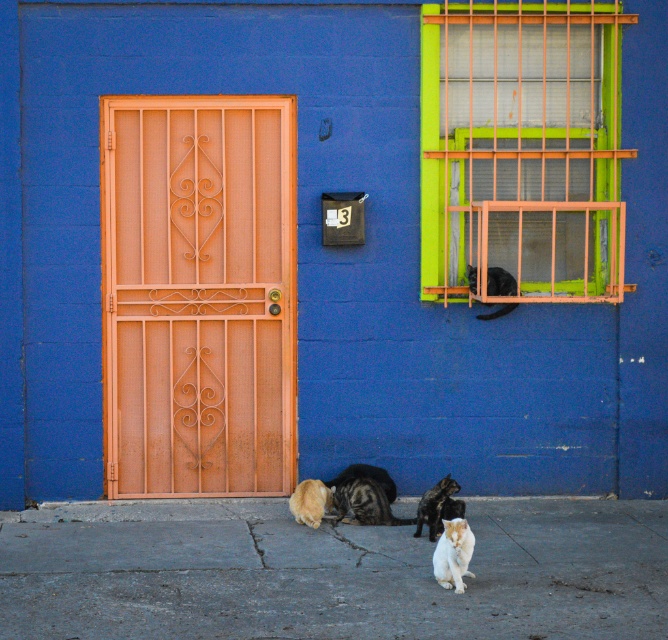
Is tabby fur cat at center below black fur cat at upper right?

Yes, tabby fur cat at center is below black fur cat at upper right.

This screenshot has width=668, height=640. What do you see at coordinates (363, 502) in the screenshot? I see `tabby fur cat at center` at bounding box center [363, 502].

I want to click on tabby fur cat at center, so click(x=363, y=502).

This screenshot has width=668, height=640. Describe the element at coordinates (363, 502) in the screenshot. I see `tabby fur cat at center` at that location.

Is tabby fur cat at center smaller than fluffy golden cat at lower center?

Actually, tabby fur cat at center might be larger than fluffy golden cat at lower center.

Image resolution: width=668 pixels, height=640 pixels. What are the coordinates of `tabby fur cat at center` in the screenshot? It's located at (363, 502).

Where is `tabby fur cat at center`? This screenshot has height=640, width=668. tabby fur cat at center is located at coordinates (363, 502).

Can you confirm if white fluffy cat at lower center is positioned to the right of fluffy golden cat at lower center?

Correct, you'll find white fluffy cat at lower center to the right of fluffy golden cat at lower center.

Which of these two, white fluffy cat at lower center or fluffy golden cat at lower center, stands shorter?

With less height is fluffy golden cat at lower center.

Is point (444, 566) in front of point (325, 490)?

Yes, it is.

You are a GUI agent. You are given a task and a screenshot of the screen. Output one action in this format:
    pyautogui.click(x=<x>, y=<y>)
    Task: Click on the white fluffy cat at lower center
    This screenshot has width=668, height=640.
    Given the screenshot: What is the action you would take?
    pyautogui.click(x=454, y=554)